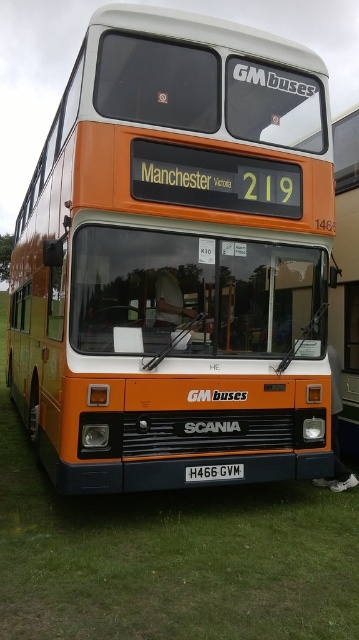
Who is lower down, orange matte bus at center or white rectangular license plate at center?

white rectangular license plate at center is below.

Based on the photo, is orange matte bus at center smaller than white rectangular license plate at center?

Yes, orange matte bus at center is smaller than white rectangular license plate at center.

Between point (211, 60) and point (235, 474), which one is positioned behind?

The point (211, 60) is behind.

Identify the location of orange matte bus at center. (176, 259).